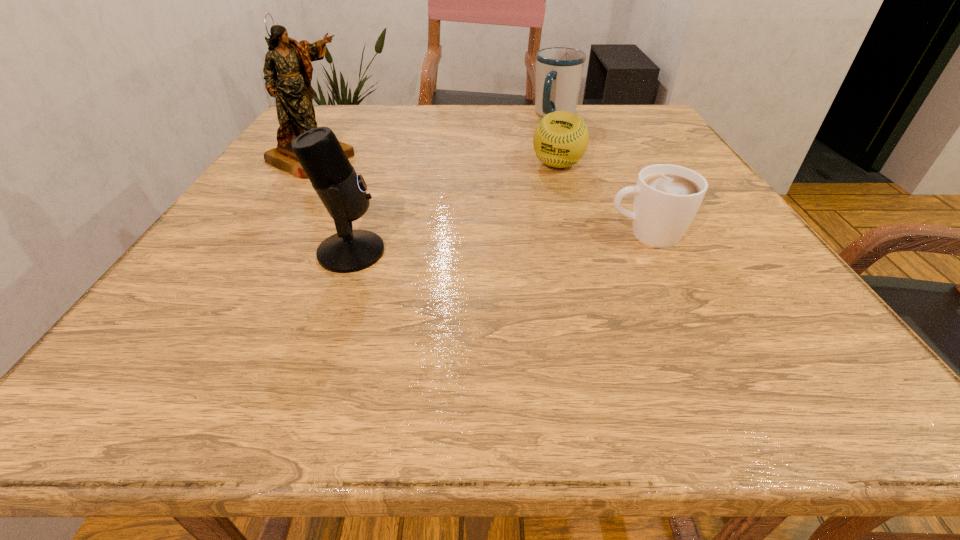
Identify the location of free region located with the handle on the side of the cappuccino. This screenshot has width=960, height=540. (552, 234).

The width and height of the screenshot is (960, 540). Identify the location of vacant space located 0.190m with the handle on the side of the cappuccino. (502, 234).

At what (x,y) coordinates should I click in order to perform the action: click on free space located on the front-facing side of the tallest object. Please return your answer as a coordinate pair (x, y). The image size is (960, 540). Looking at the image, I should click on (440, 219).

This screenshot has width=960, height=540. Identify the location of vacant space located 0.370m on the front-facing side of the tallest object. (464, 230).

Find the location of `vacant area situated 0.100m on the front-facing side of the tallest object`. vacant area situated 0.100m on the front-facing side of the tallest object is located at coordinates (367, 185).

The width and height of the screenshot is (960, 540). Find the location of `free space located 0.050m on the logo side of the softball`. free space located 0.050m on the logo side of the softball is located at coordinates (547, 188).

You are a GUI agent. You are given a task and a screenshot of the screen. Output one action in this format:
    pyautogui.click(x=<x>, y=<y>)
    Task: Click on the vacant space situated on the logo side of the softball
    
    Given the screenshot: What is the action you would take?
    pyautogui.click(x=536, y=215)

Where is `free spot located on the logo side of the softball`? The height and width of the screenshot is (540, 960). free spot located on the logo side of the softball is located at coordinates (510, 273).

Where is `vacant region located on the handle side of the farthest object`? Image resolution: width=960 pixels, height=540 pixels. vacant region located on the handle side of the farthest object is located at coordinates (518, 190).

Where is `vacant space positioned 0.120m on the handle side of the farthest object`? Image resolution: width=960 pixels, height=540 pixels. vacant space positioned 0.120m on the handle side of the farthest object is located at coordinates (542, 145).